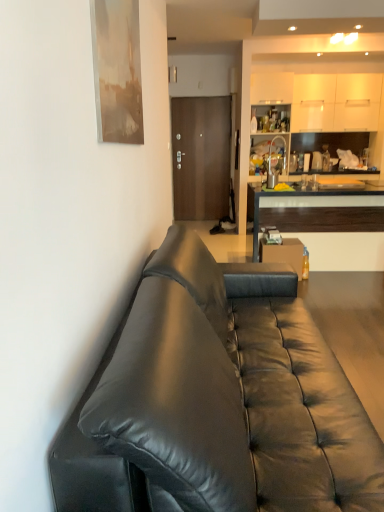
Image resolution: width=384 pixels, height=512 pixels. Find the location of `brown matte door at center`. brown matte door at center is located at coordinates (201, 157).

From a real-world perspective, is black leather couch at left on top of wooden cabinet at right?

Yes, from a real-world perspective, black leather couch at left is above wooden cabinet at right.

Does black leather couch at left appear on the left side of wooden cabinet at right?

Yes.

From the image's perspective, is black leather couch at left above wooden cabinet at right?

No.

Does black leather couch at left turn towards wooden cabinet at right?

No, black leather couch at left does not turn towards wooden cabinet at right.

Is brown matte door at center situated inside black leather couch at left or outside?

brown matte door at center is not enclosed by black leather couch at left.

This screenshot has width=384, height=512. Identify the location of door on the left of black leather couch at left. (201, 157).

Is brown matte door at center positioned with its back to black leather couch at left?

That's not correct — brown matte door at center is not looking away from black leather couch at left.

Which of these two, wooden cabinet at right or brown matte door at center, is bigger?

Bigger between the two is wooden cabinet at right.

I want to click on door behind the wooden cabinet at right, so tap(201, 157).

Looking at this image, is wooden cabinet at right taller than brown matte door at center?

No.

Could you tell me if wooden cabinet at right is turned towards brown matte door at center?

No, wooden cabinet at right is not turned towards brown matte door at center.

Is black leather couch at left aimed at brown matte door at center?

No, black leather couch at left is not aimed at brown matte door at center.

Between black leather couch at left and brown matte door at center, which one is positioned behind?

brown matte door at center is more distant.

Would you say black leather couch at left is inside or outside brown matte door at center?

black leather couch at left lies outside brown matte door at center.

In the scene shown: Does black leather couch at left have a lesser height compared to brown matte door at center?

Correct, black leather couch at left is not as tall as brown matte door at center.

Is brown matte door at center with wooden cabinet at right?

No, brown matte door at center is not with wooden cabinet at right.

Measure the distance between brown matte door at center and wooden cabinet at right.

They are 1.36 meters apart.

Considering the positions of points (184, 99) and (369, 184), is point (184, 99) closer to camera compared to point (369, 184)?

Yes, it is in front of point (369, 184).

Considering the sizes of objects brown matte door at center and wooden cabinet at right in the image provided, who is wider, brown matte door at center or wooden cabinet at right?

wooden cabinet at right is wider.

In the scene shown: From a real-world perspective, between wooden cabinet at right and black leather couch at left, who is vertically higher?

From a 3D spatial view, black leather couch at left is above.

Between wooden cabinet at right and black leather couch at left, which one has larger size?

black leather couch at left is bigger.

From the image's perspective, who appears lower, wooden cabinet at right or black leather couch at left?

black leather couch at left is shown below in the image.

Visually, is wooden cabinet at right positioned to the left or to the right of black leather couch at left?

wooden cabinet at right is positioned on black leather couch at left's right side.

This screenshot has height=512, width=384. Identify the location of cabinetry that is on the right side of black leather couch at left. (294, 195).

You are a GUI agent. You are given a task and a screenshot of the screen. Output one action in this format:
    pyautogui.click(x=<x>, y=<y>)
    Task: Click on the studio couch in front of the brown matte door at center
    This screenshot has height=512, width=384.
    Given the screenshot: What is the action you would take?
    pyautogui.click(x=217, y=400)

Estimate the real-world distances between objects in this image. Which object is closer to black leather couch at left, brown matte door at center or wooden cabinet at right?

wooden cabinet at right lies closer to black leather couch at left than the other object.

Looking at the image, which one is located further to black leather couch at left, wooden cabinet at right or brown matte door at center?

Based on the image, brown matte door at center appears to be further to black leather couch at left.

Estimate the real-world distances between objects in this image. Which object is closer to wooden cabinet at right, black leather couch at left or brown matte door at center?

Based on the image, brown matte door at center appears to be nearer to wooden cabinet at right.

Looking at the image, which one is located closer to brown matte door at center, black leather couch at left or wooden cabinet at right?

wooden cabinet at right is closer to brown matte door at center.

From the image, which object appears to be nearer to wooden cabinet at right, brown matte door at center or black leather couch at left?

brown matte door at center.

Estimate the real-world distances between objects in this image. Which object is further from brown matte door at center, wooden cabinet at right or black leather couch at left?

Among the two, black leather couch at left is located further to brown matte door at center.

Identify the location of cabinetry between black leather couch at left and brown matte door at center from front to back. This screenshot has width=384, height=512. (294, 195).